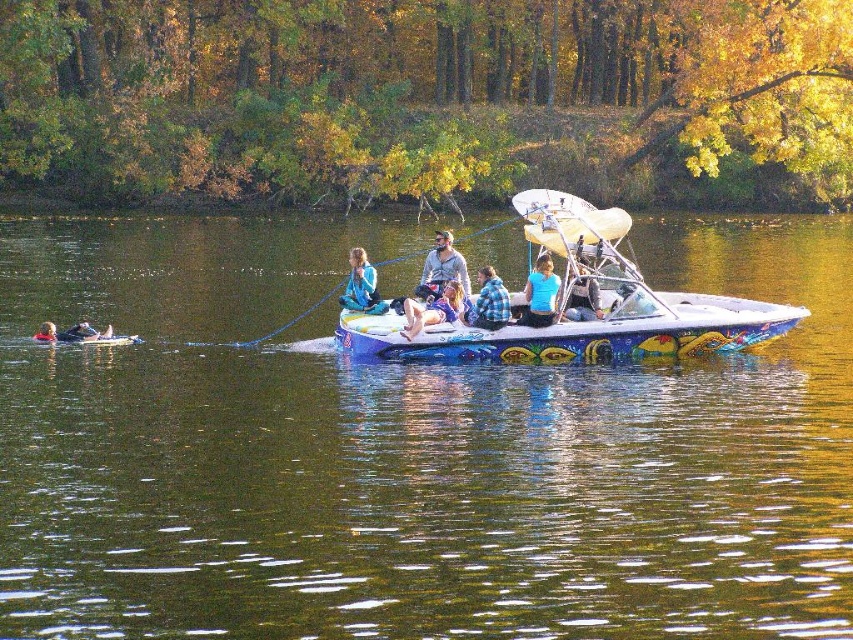
Question: Which point is closer to the camera?

Choices:
 (A) blue plaid shirt at center
 (B) matte blue life vest at lower left

Answer: (A)

Question: Considering the relative positions of greenish water at center and blue plaid shirt at center in the image provided, where is greenish water at center located with respect to blue plaid shirt at center?

Choices:
 (A) left
 (B) right

Answer: (A)

Question: Which object is the farthest from the matte blue shirt at center?

Choices:
 (A) greenish water at center
 (B) gray cotton shirt at center
 (C) blue denim shorts at center

Answer: (A)

Question: Which of the following is the closest to the observer?

Choices:
 (A) (496, 328)
 (B) (370, 273)
 (C) (79, 330)

Answer: (A)

Question: Can you confirm if gray cotton shirt at center is positioned to the right of matte blue life vest at lower left?

Choices:
 (A) yes
 (B) no

Answer: (A)

Question: Is blue fabric jacket at center wider than matte blue life vest at lower left?

Choices:
 (A) no
 (B) yes

Answer: (B)